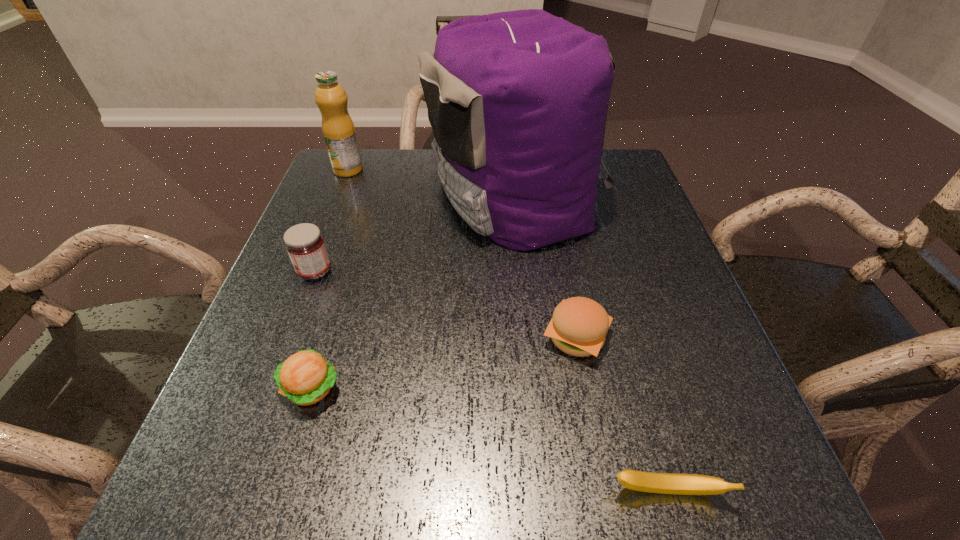
Find the location of `vacant space located 0.240m on the front pocket of the backpack`. vacant space located 0.240m on the front pocket of the backpack is located at coordinates (332, 197).

Identify the location of free location located 0.090m on the front label of the fruit juice. This screenshot has width=960, height=540. (337, 197).

Find the location of a particular element. vacant region located 0.310m on the front of the third tallest object is located at coordinates (255, 428).

The image size is (960, 540). I want to click on vacant space situated 0.070m on the left of the right hamburger, so click(x=502, y=338).

Find the location of `free space located on the back of the left hamburger`. free space located on the back of the left hamburger is located at coordinates (356, 240).

This screenshot has height=540, width=960. I want to click on backpack that is positioned at the far edge, so click(x=517, y=101).

This screenshot has height=540, width=960. In order to click on fruit juice that is at the far edge in this screenshot , I will do `click(338, 129)`.

I want to click on object that is positioned at the near edge, so click(x=664, y=483).

Where is `fruit juice at the left edge`? fruit juice at the left edge is located at coordinates (338, 129).

Identify the location of jam that is at the left edge. This screenshot has width=960, height=540. (305, 245).